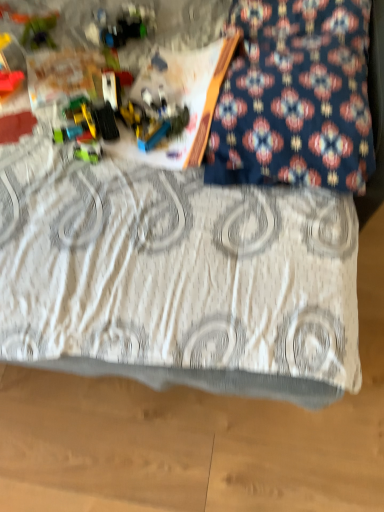
Identify the location of white textured blanket at center. This screenshot has width=384, height=512. pyautogui.click(x=176, y=277).

What do you see at coordinates (176, 277) in the screenshot? I see `white textured blanket at center` at bounding box center [176, 277].

Image resolution: width=384 pixels, height=512 pixels. Describe the element at coordinates (295, 97) in the screenshot. I see `dark blue patterned pillow at upper right` at that location.

You are a GUI agent. You are given a task and a screenshot of the screen. Output one action in this format:
    pyautogui.click(x=<x>, y=<y>)
    Task: Click on the green plastic toy at upper left, which is the 2th toy from top to bottom
    The width and height of the screenshot is (384, 512).
    Given the screenshot: What is the action you would take?
    pyautogui.click(x=39, y=32)

The height and width of the screenshot is (512, 384). I want to click on translucent plastic construction set at upper left, positioned as the 3th toy in top-to-bottom order, so click(x=80, y=131).

Is white textured blanket at center oriented away from translucent plastic construction set at upper left, positioned as the 3th toy in top-to-bottom order?

Yes.

From a real-world perspective, is white textured blanket at center on translucent plastic construction set at upper left, positioned as the 3th toy in top-to-bottom order?

Yes, from a real-world perspective, white textured blanket at center is above translucent plastic construction set at upper left, positioned as the 3th toy in top-to-bottom order.

Considering the sizes of objects white textured blanket at center and translucent plastic construction set at upper left, the 1th toy in the bottom-to-top sequence, in the image provided, who is bigger, white textured blanket at center or translucent plastic construction set at upper left, the 1th toy in the bottom-to-top sequence,?

white textured blanket at center.

This screenshot has width=384, height=512. In order to click on the 2nd toy positioned below the dark blue patterned pillow at upper right (from a real-world perspective) in this screenshot , I will do `click(39, 32)`.

Which point is more forward, (40, 46) or (269, 114)?

Point (269, 114)

Would you say green plastic toy at upper left, arranged as the 2th toy when ordered from the bottom, contains dark blue patterned pillow at upper right?

Actually, dark blue patterned pillow at upper right is outside green plastic toy at upper left, arranged as the 2th toy when ordered from the bottom.

Is green plastic toy at upper left, which is the 2th toy from top to bottom, bigger than dark blue patterned pillow at upper right?

Actually, green plastic toy at upper left, which is the 2th toy from top to bottom, might be smaller than dark blue patterned pillow at upper right.

Is shiny plastic toy at upper left, which is the 1th toy in top-to-bottom order, closer to camera compared to white textured blanket at center?

No, it is behind white textured blanket at center.

Which of these two, shiny plastic toy at upper left, which is the 1th toy in top-to-bottom order, or white textured blanket at center, is wider?

white textured blanket at center.

From a real-world perspective, who is located higher, shiny plastic toy at upper left, the 3th toy when ordered from bottom to top, or white textured blanket at center?

In real-world perspective, white textured blanket at center is above.

Visually, is white textured blanket at center positioned to the left or to the right of shiny plastic toy at upper left, which is the 1th toy in top-to-bottom order?

Based on their positions, white textured blanket at center is located to the right of shiny plastic toy at upper left, which is the 1th toy in top-to-bottom order.

Considering the sizes of objects white textured blanket at center and shiny plastic toy at upper left, the 3th toy when ordered from bottom to top, in the image provided, who is wider, white textured blanket at center or shiny plastic toy at upper left, the 3th toy when ordered from bottom to top,?

Wider between the two is white textured blanket at center.

From the image's perspective, between white textured blanket at center and shiny plastic toy at upper left, which is the 1th toy in top-to-bottom order, who is located below?

white textured blanket at center, from the image's perspective.

Looking at this image, is white textured blanket at center in contact with shiny plastic toy at upper left, the 3th toy when ordered from bottom to top?

white textured blanket at center and shiny plastic toy at upper left, the 3th toy when ordered from bottom to top, are clearly separated.

Which is further, [97,147] or [180,326]?

The point [97,147] is behind.

Is translucent plastic construction set at upper left, the 1th toy in the bottom-to-top sequence, in contact with white textured blanket at center?

No, translucent plastic construction set at upper left, the 1th toy in the bottom-to-top sequence, is not touching white textured blanket at center.

Is translucent plastic construction set at upper left, positioned as the 3th toy in top-to-bottom order, in front of or behind white textured blanket at center in the image?

translucent plastic construction set at upper left, positioned as the 3th toy in top-to-bottom order, is behind white textured blanket at center.

From the picture: Could white textured blanket at center be considered to be inside translucent plastic construction set at upper left, positioned as the 3th toy in top-to-bottom order?

No, white textured blanket at center is located outside of translucent plastic construction set at upper left, positioned as the 3th toy in top-to-bottom order.

From a real-world perspective, which is physically above, translucent plastic construction set at upper left, positioned as the 3th toy in top-to-bottom order, or dark blue patterned pillow at upper right?

dark blue patterned pillow at upper right, from a real-world perspective.

Is translucent plastic construction set at upper left, the 1th toy in the bottom-to-top sequence, wider than dark blue patterned pillow at upper right?

No.

From the image's perspective, is translucent plastic construction set at upper left, the 1th toy in the bottom-to-top sequence, located above dark blue patterned pillow at upper right?

Actually, translucent plastic construction set at upper left, the 1th toy in the bottom-to-top sequence, appears below dark blue patterned pillow at upper right in the image.

Based on the photo, is translucent plastic construction set at upper left, the 1th toy in the bottom-to-top sequence, inside or outside of dark blue patterned pillow at upper right?

translucent plastic construction set at upper left, the 1th toy in the bottom-to-top sequence, is outside dark blue patterned pillow at upper right.

Looking at their sizes, would you say dark blue patterned pillow at upper right is wider or thinner than green plastic toy at upper left, arranged as the 2th toy when ordered from the bottom?

In the image, dark blue patterned pillow at upper right appears to be wider than green plastic toy at upper left, arranged as the 2th toy when ordered from the bottom.

Is dark blue patterned pillow at upper right behind green plastic toy at upper left, which is the 2th toy from top to bottom?

No, the depth of dark blue patterned pillow at upper right is less than that of green plastic toy at upper left, which is the 2th toy from top to bottom.

At what (x,y) coordinates should I click in order to perform the action: click on pillow located in front of the green plastic toy at upper left, which is the 2th toy from top to bottom. Please return your answer as a coordinate pair (x, y). This screenshot has width=384, height=512. Looking at the image, I should click on point(295,97).

In the scene shown: Which object is positioned more to the right, dark blue patterned pillow at upper right or green plastic toy at upper left, arranged as the 2th toy when ordered from the bottom?

dark blue patterned pillow at upper right is more to the right.

The width and height of the screenshot is (384, 512). Find the location of `bedding lying above the translucent plastic construction set at upper left, positioned as the 3th toy in top-to-bottom order (from the image's perspective)`. bedding lying above the translucent plastic construction set at upper left, positioned as the 3th toy in top-to-bottom order (from the image's perspective) is located at coordinates (x=176, y=277).

The width and height of the screenshot is (384, 512). I want to click on pillow located below the green plastic toy at upper left, which is the 2th toy from top to bottom (from the image's perspective), so click(295, 97).

Looking at the image, which one is located closer to white textured blanket at center, green plastic toy at upper left, arranged as the 2th toy when ordered from the bottom, or dark blue patterned pillow at upper right?

Among the two, dark blue patterned pillow at upper right is located nearer to white textured blanket at center.

Considering their positions, is translucent plastic construction set at upper left, the 1th toy in the bottom-to-top sequence, positioned closer to shiny plastic toy at upper left, the 3th toy when ordered from bottom to top, than white textured blanket at center?

Among the two, translucent plastic construction set at upper left, the 1th toy in the bottom-to-top sequence, is located nearer to shiny plastic toy at upper left, the 3th toy when ordered from bottom to top.

Consider the image. Which object lies nearer to the anchor point dark blue patterned pillow at upper right, shiny plastic toy at upper left, which is the 1th toy in top-to-bottom order, or green plastic toy at upper left, which is the 2th toy from top to bottom?

Based on the image, shiny plastic toy at upper left, which is the 1th toy in top-to-bottom order, appears to be nearer to dark blue patterned pillow at upper right.

Considering their positions, is green plastic toy at upper left, arranged as the 2th toy when ordered from the bottom, positioned closer to shiny plastic toy at upper left, which is the 1th toy in top-to-bottom order, than dark blue patterned pillow at upper right?

Based on the image, green plastic toy at upper left, arranged as the 2th toy when ordered from the bottom, appears to be nearer to shiny plastic toy at upper left, which is the 1th toy in top-to-bottom order.

Estimate the real-world distances between objects in this image. Which object is further from translucent plastic construction set at upper left, the 1th toy in the bottom-to-top sequence, white textured blanket at center or dark blue patterned pillow at upper right?

dark blue patterned pillow at upper right lies further to translucent plastic construction set at upper left, the 1th toy in the bottom-to-top sequence, than the other object.

Which object lies further to the anchor point translucent plastic construction set at upper left, the 1th toy in the bottom-to-top sequence, dark blue patterned pillow at upper right or white textured blanket at center?

dark blue patterned pillow at upper right is positioned further to the anchor translucent plastic construction set at upper left, the 1th toy in the bottom-to-top sequence.

Based on their spatial positions, is white textured blanket at center or translucent plastic construction set at upper left, the 1th toy in the bottom-to-top sequence, closer to shiny plastic toy at upper left, the 3th toy when ordered from bottom to top?

translucent plastic construction set at upper left, the 1th toy in the bottom-to-top sequence, lies closer to shiny plastic toy at upper left, the 3th toy when ordered from bottom to top, than the other object.

When comparing their distances from white textured blanket at center, does dark blue patterned pillow at upper right or green plastic toy at upper left, arranged as the 2th toy when ordered from the bottom, seem further?

Based on the image, green plastic toy at upper left, arranged as the 2th toy when ordered from the bottom, appears to be further to white textured blanket at center.

Identify the location of pillow between white textured blanket at center and green plastic toy at upper left, arranged as the 2th toy when ordered from the bottom, in the front-back direction. (295, 97).

Locate an element on the screen. This screenshot has width=384, height=512. toy between shiny plastic toy at upper left, which is the 1th toy in top-to-bottom order, and translucent plastic construction set at upper left, positioned as the 3th toy in top-to-bottom order, in the vertical direction is located at coordinates (39, 32).

Identify the location of toy between translucent plastic construction set at upper left, positioned as the 3th toy in top-to-bottom order, and dark blue patterned pillow at upper right, in the horizontal direction. The width and height of the screenshot is (384, 512). point(124,25).

Find the location of a particular element. pillow between white textured blanket at center and shiny plastic toy at upper left, the 3th toy when ordered from bottom to top, from front to back is located at coordinates (295, 97).